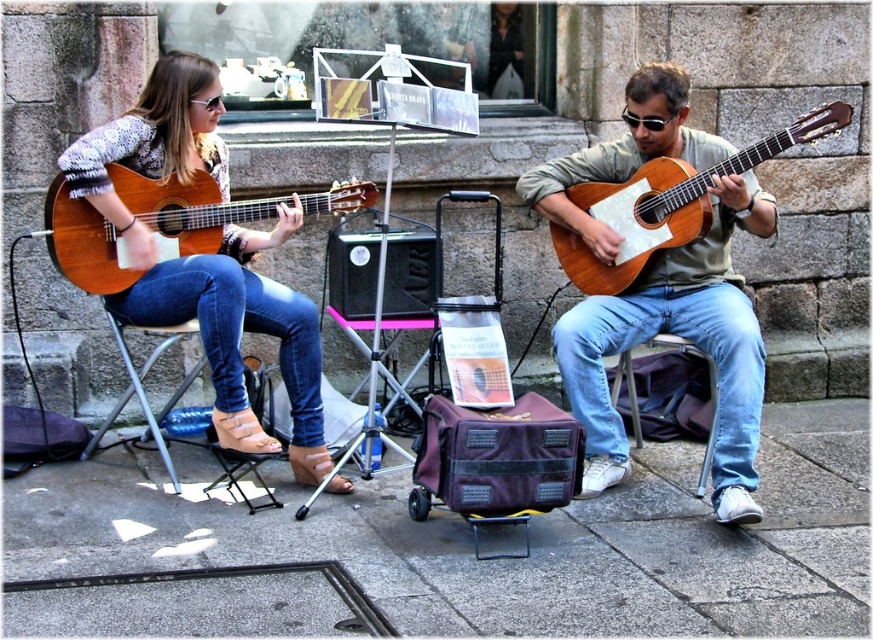
Question: Does metallic silver chair at lower left appear under white plastic chair at lower center?

Choices:
 (A) no
 (B) yes

Answer: (B)

Question: Is matte wood guitar at left behind light brown wood guitar at right?

Choices:
 (A) yes
 (B) no

Answer: (B)

Question: Which is nearer to the light brown wood guitar at right?

Choices:
 (A) matte brown guitar at center
 (B) matte wood guitar at left

Answer: (A)

Question: Which point is closer to the camera?

Choices:
 (A) metallic silver chair at lower left
 (B) light brown wood guitar at right
 (C) smooth concrete pavement at center

Answer: (C)

Question: Among these points, which one is farthest from the camera?

Choices:
 (A) (205, 492)
 (B) (555, 250)
 (C) (242, 282)

Answer: (B)

Question: Is smooth concrete pavement at center above light brown wood guitar at right?

Choices:
 (A) no
 (B) yes

Answer: (A)